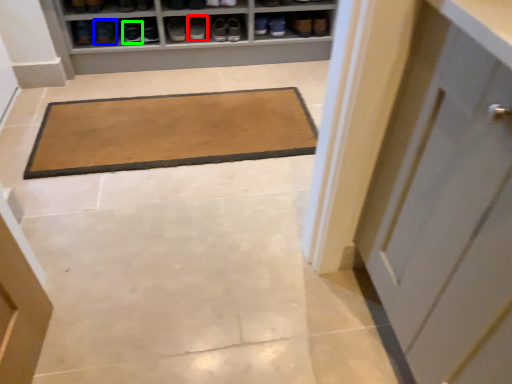
Question: Which object is positioned closest to footwear (highlighted by a red box)? Select from footwear (highlighted by a blue box) and footwear (highlighted by a green box).

Choices:
 (A) footwear
 (B) footwear

Answer: (B)